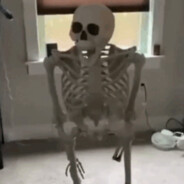
You are a GUI agent. You are given a task and a screenshot of the screen. Output one action in this format:
    pyautogui.click(x=<x>, y=<y>)
    Task: Click on the outlet
    The image size is (184, 184).
    Given the screenshot: What is the action you would take?
    pyautogui.click(x=142, y=88)